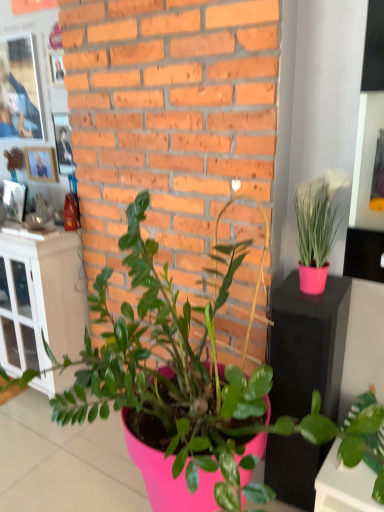
Question: From the image's perspective, is white glass cabinet at left located above pink matte plant at center, the 2th houseplant viewed from the right?

Choices:
 (A) no
 (B) yes

Answer: (B)

Question: Does white glass cabinet at left come behind pink matte plant at center, the 2th houseplant viewed from the right?

Choices:
 (A) no
 (B) yes

Answer: (B)

Question: Is white glass cabinet at left in contact with pink matte plant at center, acting as the first houseplant starting from the left?

Choices:
 (A) yes
 (B) no

Answer: (B)

Question: Is white glass cabinet at left at the left side of pink matte plant at center, the 2th houseplant viewed from the right?

Choices:
 (A) no
 (B) yes

Answer: (B)

Question: Is white glass cabinet at left closer to camera compared to pink matte plant at center, acting as the first houseplant starting from the left?

Choices:
 (A) no
 (B) yes

Answer: (A)

Question: Would you say green matte plant at lower right, positioned as the first houseplant in right-to-left order, is inside or outside pink matte plant at center, acting as the first houseplant starting from the left?

Choices:
 (A) inside
 (B) outside

Answer: (A)

Question: Is green matte plant at lower right, the second houseplant when ordered from left to right, wider or thinner than pink matte plant at center, acting as the first houseplant starting from the left?

Choices:
 (A) thin
 (B) wide

Answer: (A)

Question: Relative to pink matte plant at center, the 2th houseplant viewed from the right, is green matte plant at lower right, positioned as the first houseplant in right-to-left order, in front or behind?

Choices:
 (A) front
 (B) behind

Answer: (B)

Question: Is green matte plant at lower right, positioned as the first houseplant in right-to-left order, taller or shorter than pink matte plant at center, acting as the first houseplant starting from the left?

Choices:
 (A) short
 (B) tall

Answer: (A)

Question: Considering the positions of point (44, 159) and point (311, 417), is point (44, 159) closer or farther from the camera than point (311, 417)?

Choices:
 (A) farther
 (B) closer

Answer: (A)

Question: From their relative heights in the image, would you say wooden photo frame at upper left is taller or shorter than pink matte plant at center, acting as the first houseplant starting from the left?

Choices:
 (A) short
 (B) tall

Answer: (A)

Question: Is wooden photo frame at upper left bigger or smaller than pink matte plant at center, the 2th houseplant viewed from the right?

Choices:
 (A) big
 (B) small

Answer: (B)

Question: From the image's perspective, is wooden photo frame at upper left above or below pink matte plant at center, acting as the first houseplant starting from the left?

Choices:
 (A) below
 (B) above

Answer: (B)

Question: In terms of height, does green matte plant at lower right, the second houseplant when ordered from left to right, look taller or shorter compared to wooden photo frame at upper left?

Choices:
 (A) short
 (B) tall

Answer: (B)

Question: From the image's perspective, is green matte plant at lower right, the second houseplant when ordered from left to right, located above or below wooden photo frame at upper left?

Choices:
 (A) below
 (B) above

Answer: (A)